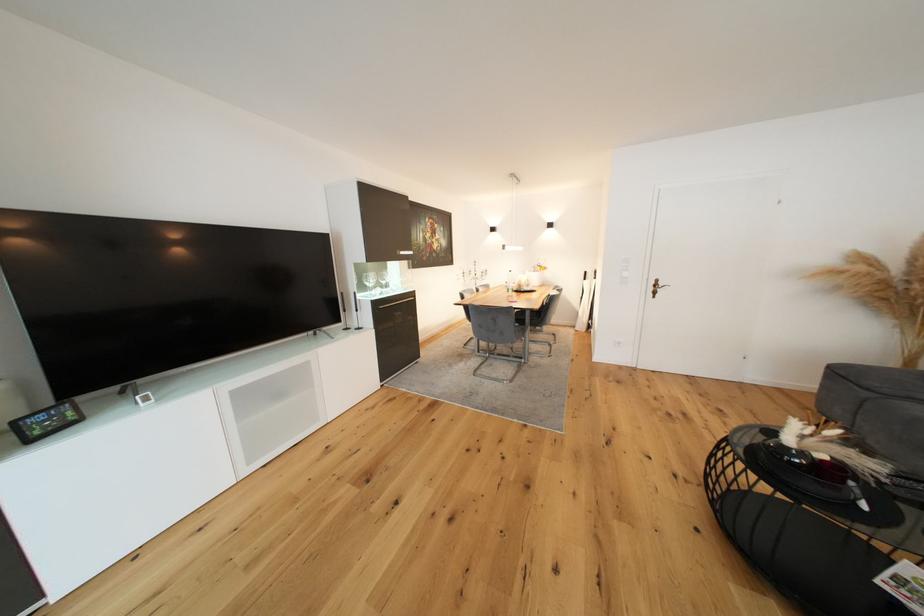
Image resolution: width=924 pixels, height=616 pixels. What do you see at coordinates (805, 474) in the screenshot?
I see `the small black bowl` at bounding box center [805, 474].